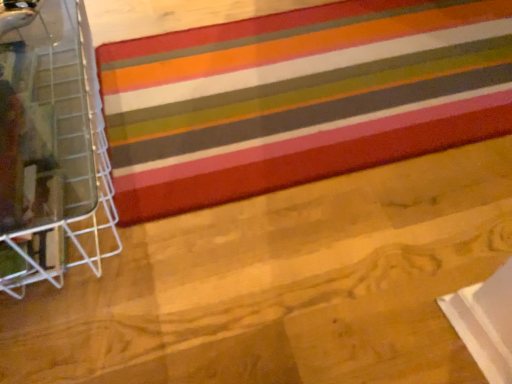
Identify the location of vacant space in between clear plastic basket at left and multicolored striped rug at center. pyautogui.click(x=288, y=188).